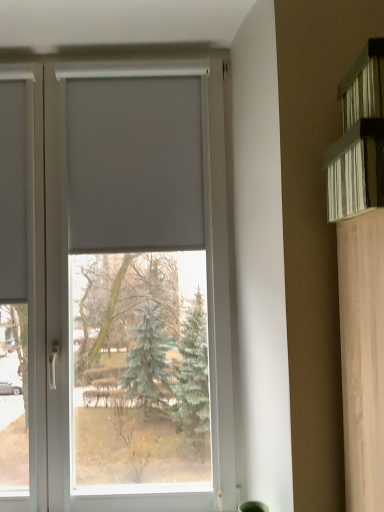
Locate an element on the screen. The height and width of the screenshot is (512, 384). white matte blind at center is located at coordinates (134, 164).

The height and width of the screenshot is (512, 384). In order to click on white textured shelf at upper right in this screenshot , I will do `click(358, 138)`.

Consider the image. From the image's perspective, would you say white matte window at center is positioned over white textured shelf at upper right?

No.

Would you say white matte window at center contains white textured shelf at upper right?

No, white textured shelf at upper right is not surrounded by white matte window at center.

Considering the relative sizes of white matte window at center and white textured shelf at upper right in the image provided, is white matte window at center wider than white textured shelf at upper right?

No, white matte window at center is not wider than white textured shelf at upper right.

Is white matte window at center positioned in front of white textured shelf at upper right?

No, the depth of white matte window at center is greater than that of white textured shelf at upper right.

Is white matte blind at center outside of white matte window at center?

No, white matte blind at center is not outside of white matte window at center.

Relative to white matte window at center, is white matte blind at center in front or behind?

Clearly, white matte blind at center is behind white matte window at center.

Is point (100, 128) positioned in front of point (183, 501)?

No, (100, 128) is behind (183, 501).

Between white matte blind at center and white matte window at center, which one has less height?

white matte blind at center.

Considering the relative sizes of white matte blind at center and white textured shelf at upper right in the image provided, is white matte blind at center bigger than white textured shelf at upper right?

Yes, white matte blind at center is bigger than white textured shelf at upper right.

Would you say white matte blind at center is to the left or to the right of white textured shelf at upper right in the picture?

From the image, it's evident that white matte blind at center is to the left of white textured shelf at upper right.

Would you say white matte blind at center contains white textured shelf at upper right?

Definitely not — white textured shelf at upper right is not inside white matte blind at center.

Does white matte window at center have a greater width compared to white matte blind at center?

Yes.

From a real-world perspective, between white matte window at center and white matte blind at center, who is vertically higher?

white matte blind at center, from a real-world perspective.

Can you confirm if white matte window at center is taller than white matte blind at center?

Yes.

Is white matte window at center beside white matte blind at center?

No, white matte window at center is not in contact with white matte blind at center.

Measure the distance between white textured shelf at upper right and white matte window at center.

The distance of white textured shelf at upper right from white matte window at center is 28.49 inches.

Is white textured shelf at upper right oriented towards white matte window at center?

No, white textured shelf at upper right is not turned towards white matte window at center.

Which object is positioned more to the left, white textured shelf at upper right or white matte window at center?

white matte window at center.

Is white textured shelf at upper right not close to white matte window at center?

That's not correct — white textured shelf at upper right is a little close to white matte window at center.

Find the location of a particular element. The width and height of the screenshot is (384, 512). blind that is on the left side of white textured shelf at upper right is located at coordinates (134, 164).

From the image's perspective, between white textured shelf at upper right and white matte blind at center, which one is located above?

white textured shelf at upper right is shown above in the image.

Is white textured shelf at upper right far away from white matte blind at center?

white textured shelf at upper right is actually quite close to white matte blind at center.

Can you confirm if white textured shelf at upper right is positioned to the right of white matte blind at center?

Yes, white textured shelf at upper right is to the right of white matte blind at center.

I want to click on shelf above the white matte window at center (from a real-world perspective), so click(358, 138).

I want to click on blind lying on the right of white matte window at center, so click(x=134, y=164).

Based on their spatial positions, is white textured shelf at upper right or white matte blind at center further from white matte window at center?

white textured shelf at upper right lies further to white matte window at center than the other object.

Which object lies further to the anchor point white matte window at center, white matte blind at center or white textured shelf at upper right?

white textured shelf at upper right is further to white matte window at center.

Estimate the real-world distances between objects in this image. Which object is further from white textured shelf at upper right, white matte blind at center or white matte window at center?

white matte window at center lies further to white textured shelf at upper right than the other object.

When comparing their distances from white matte blind at center, does white textured shelf at upper right or white matte window at center seem further?

Among the two, white textured shelf at upper right is located further to white matte blind at center.

Considering their positions, is white matte window at center positioned closer to white matte blind at center than white textured shelf at upper right?

white matte window at center lies closer to white matte blind at center than the other object.

From the image, which object appears to be farther from white textured shelf at upper right, white matte window at center or white matte blind at center?

white matte window at center is further to white textured shelf at upper right.

In order to click on blind between white matte window at center and white textured shelf at upper right in the horizontal direction in this screenshot , I will do coord(134,164).